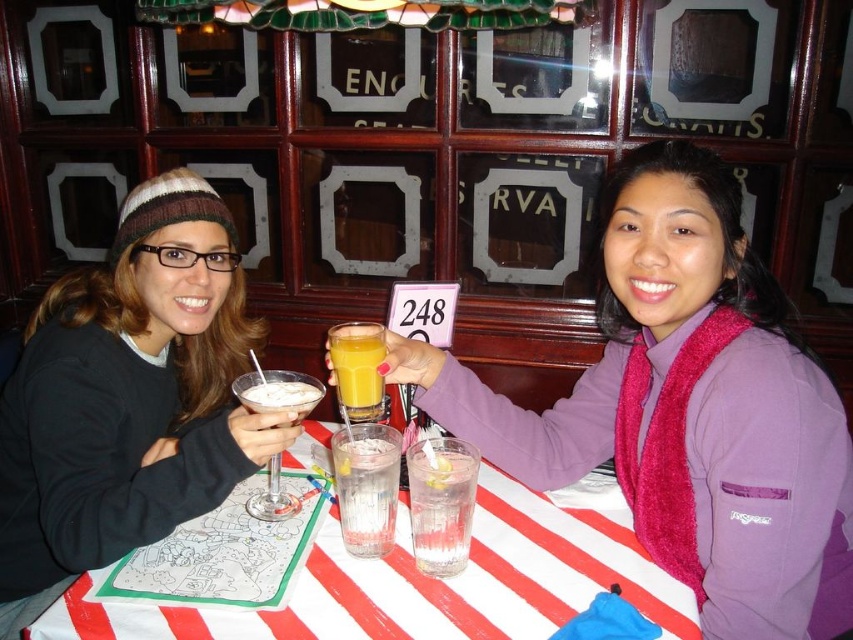
Question: Can you confirm if matte black beanie at left is thinner than matte chocolate martini glass at center?

Choices:
 (A) no
 (B) yes

Answer: (A)

Question: Which point appears farthest from the camera in this image?

Choices:
 (A) (439, 536)
 (B) (171, 531)
 (C) (544, 522)
 (D) (473, 378)

Answer: (D)

Question: Which of the following is the farthest from the observer?

Choices:
 (A) purple fleece vest at center
 (B) clear glass at center

Answer: (B)

Question: Based on their relative distances, which object is nearer to the clear glass at table center?

Choices:
 (A) purple fleece vest at center
 (B) orange matte glass at center
 (C) clear glass at center
 (D) matte black beanie at left

Answer: (C)

Question: Is clear glass at table center to the left of matte chocolate martini glass at center from the viewer's perspective?

Choices:
 (A) yes
 (B) no

Answer: (B)

Question: Does matte black beanie at left appear over orange matte glass at center?

Choices:
 (A) yes
 (B) no

Answer: (B)